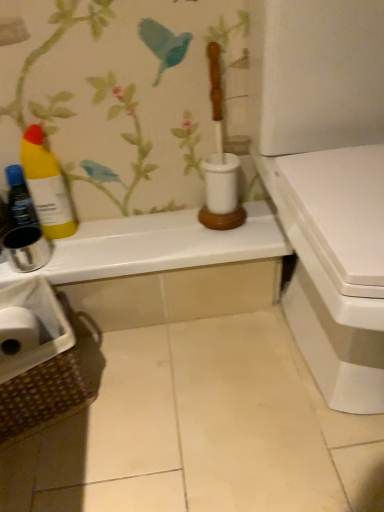
What do you see at coordinates (47, 186) in the screenshot? The image size is (384, 512). I see `yellow matte bottle at left, which is the 2th bottle from left to right` at bounding box center [47, 186].

I want to click on white glossy counter top at upper center, so click(156, 246).

Identify the location of metallic silver bottle at left, which is counted as the 2th bottle, starting from the right. (20, 198).

How much space does metallic silver bottle at left, which is counted as the 2th bottle, starting from the right, occupy horizontally?

It is 2.54 inches.

The image size is (384, 512). Identify the location of white glossy toilet at right. (327, 181).

Image resolution: width=384 pixels, height=512 pixels. Identify the location of counter top that appears above the brown woven laundry basket at lower left (from the image's perspective). (156, 246).

Does point (73, 362) come behind point (245, 204)?

No.

Considering the sizes of objects brown woven laundry basket at lower left and white glossy counter top at upper center in the image provided, who is shorter, brown woven laundry basket at lower left or white glossy counter top at upper center?

white glossy counter top at upper center.

Is brown woven laundry basket at lower left positioned with its back to white glossy counter top at upper center?

No, brown woven laundry basket at lower left is not facing the opposite direction of white glossy counter top at upper center.

Does brown woven laundry basket at lower left turn towards metallic silver bottle at left, which is counted as the 2th bottle, starting from the right?

No, brown woven laundry basket at lower left is not facing towards metallic silver bottle at left, which is counted as the 2th bottle, starting from the right.

Which object is positioned more to the right, brown woven laundry basket at lower left or metallic silver bottle at left, which is counted as the 2th bottle, starting from the right?

Positioned to the right is brown woven laundry basket at lower left.

From a real-world perspective, is brown woven laundry basket at lower left positioned above or below metallic silver bottle at left, the 1th bottle in the left-to-right sequence?

brown woven laundry basket at lower left is situated lower than metallic silver bottle at left, the 1th bottle in the left-to-right sequence, in the real world.

Between brown woven laundry basket at lower left and metallic silver bottle at left, the 1th bottle in the left-to-right sequence, which one is positioned in front?

brown woven laundry basket at lower left is in front.

Is metallic silver bottle at left, which is counted as the 2th bottle, starting from the right, in front of brown woven laundry basket at lower left?

That is False.

From the image's perspective, is metallic silver bottle at left, which is counted as the 2th bottle, starting from the right, below brown woven laundry basket at lower left?

No, from the image's perspective, metallic silver bottle at left, which is counted as the 2th bottle, starting from the right, is not beneath brown woven laundry basket at lower left.

Which object is positioned more to the right, metallic silver bottle at left, the 1th bottle in the left-to-right sequence, or brown woven laundry basket at lower left?

Positioned to the right is brown woven laundry basket at lower left.

Between metallic silver bottle at left, the 1th bottle in the left-to-right sequence, and brown woven laundry basket at lower left, which one has larger size?

Bigger between the two is brown woven laundry basket at lower left.

Is white glossy toilet at right positioned beyond the bounds of metallic silver bottle at left, which is counted as the 2th bottle, starting from the right?

Yes, white glossy toilet at right is outside of metallic silver bottle at left, which is counted as the 2th bottle, starting from the right.

Measure the distance between white glossy toilet at right and metallic silver bottle at left, which is counted as the 2th bottle, starting from the right.

white glossy toilet at right is 70.51 centimeters away from metallic silver bottle at left, which is counted as the 2th bottle, starting from the right.

Does white glossy toilet at right turn towards metallic silver bottle at left, the 1th bottle in the left-to-right sequence?

No.

Is white glossy toilet at right next to metallic silver bottle at left, the 1th bottle in the left-to-right sequence, and touching it?

white glossy toilet at right and metallic silver bottle at left, the 1th bottle in the left-to-right sequence, are clearly separated.

Can you confirm if metallic silver bottle at left, which is counted as the 2th bottle, starting from the right, is shorter than white glossy toilet at right?

Yes, metallic silver bottle at left, which is counted as the 2th bottle, starting from the right, is shorter than white glossy toilet at right.

From a real-world perspective, is metallic silver bottle at left, the 1th bottle in the left-to-right sequence, on top of white glossy toilet at right?

No.

Is point (18, 220) positioned before point (361, 183)?

No, (18, 220) is behind (361, 183).

Looking at this image, considering the sizes of white glossy counter top at upper center and yellow matte bottle at left, which is the 2th bottle from left to right, in the image, is white glossy counter top at upper center wider or thinner than yellow matte bottle at left, which is the 2th bottle from left to right,?

Considering their sizes, white glossy counter top at upper center looks broader than yellow matte bottle at left, which is the 2th bottle from left to right.

From a real-world perspective, is white glossy counter top at upper center physically located above or below yellow matte bottle at left, which is the 2th bottle from left to right?

From a real-world perspective, white glossy counter top at upper center is physically below yellow matte bottle at left, which is the 2th bottle from left to right.

Is white glossy counter top at upper center next to yellow matte bottle at left, the 1th bottle viewed from the right?

No.

In the image, is white glossy counter top at upper center on the left side or the right side of yellow matte bottle at left, which is the 2th bottle from left to right?

white glossy counter top at upper center is to the right of yellow matte bottle at left, which is the 2th bottle from left to right.

How distant is yellow matte bottle at left, the 1th bottle viewed from the right, from white glossy counter top at upper center?

yellow matte bottle at left, the 1th bottle viewed from the right, and white glossy counter top at upper center are 21.96 centimeters apart from each other.

Which of these two, yellow matte bottle at left, the 1th bottle viewed from the right, or white glossy counter top at upper center, stands taller?

yellow matte bottle at left, the 1th bottle viewed from the right, is taller.

Locate an element on the screen. bottle in front of the white glossy counter top at upper center is located at coordinates (47, 186).

From a real-world perspective, which is physically above, yellow matte bottle at left, the 1th bottle viewed from the right, or white glossy counter top at upper center?

From a 3D spatial view, yellow matte bottle at left, the 1th bottle viewed from the right, is above.

You are a GUI agent. You are given a task and a screenshot of the screen. Output one action in this format:
    pyautogui.click(x=<x>, y=<y>)
    Task: Click on the laundry basket in front of the white glossy counter top at upper center
    
    Given the screenshot: What is the action you would take?
    pyautogui.click(x=39, y=359)

There is a brown woven laundry basket at lower left. Find the location of `the 1st bottle above it (from the image's perspective)`. the 1st bottle above it (from the image's perspective) is located at coordinates (20, 198).

Estimate the real-world distances between objects in this image. Which object is further from metallic silver bottle at left, which is counted as the 2th bottle, starting from the right, yellow matte bottle at left, which is the 2th bottle from left to right, or brown woven laundry basket at lower left?

brown woven laundry basket at lower left lies further to metallic silver bottle at left, which is counted as the 2th bottle, starting from the right, than the other object.

From the image, which object appears to be nearer to metallic silver bottle at left, the 1th bottle in the left-to-right sequence, white glossy counter top at upper center or yellow matte bottle at left, the 1th bottle viewed from the right?

Among the two, yellow matte bottle at left, the 1th bottle viewed from the right, is located nearer to metallic silver bottle at left, the 1th bottle in the left-to-right sequence.

From the image, which object appears to be farther from white glossy counter top at upper center, brown woven laundry basket at lower left or metallic silver bottle at left, which is counted as the 2th bottle, starting from the right?

The object further to white glossy counter top at upper center is metallic silver bottle at left, which is counted as the 2th bottle, starting from the right.

Considering their positions, is white glossy toilet at right positioned closer to brown woven laundry basket at lower left than white glossy counter top at upper center?

The object closer to brown woven laundry basket at lower left is white glossy counter top at upper center.

Estimate the real-world distances between objects in this image. Which object is closer to metallic silver bottle at left, which is counted as the 2th bottle, starting from the right, white glossy counter top at upper center or white glossy toilet at right?

Based on the image, white glossy counter top at upper center appears to be nearer to metallic silver bottle at left, which is counted as the 2th bottle, starting from the right.

When comparing their distances from white glossy toilet at right, does brown woven laundry basket at lower left or yellow matte bottle at left, which is the 2th bottle from left to right, seem further?

The object further to white glossy toilet at right is yellow matte bottle at left, which is the 2th bottle from left to right.

Looking at the image, which one is located further to white glossy counter top at upper center, yellow matte bottle at left, the 1th bottle viewed from the right, or white glossy toilet at right?

The object further to white glossy counter top at upper center is white glossy toilet at right.

Which object lies further to the anchor point white glossy toilet at right, white glossy counter top at upper center or brown woven laundry basket at lower left?

brown woven laundry basket at lower left is further to white glossy toilet at right.

The image size is (384, 512). What are the coordinates of `counter top located between yellow matte bottle at left, the 1th bottle viewed from the right, and white glossy toilet at right in the left-right direction` in the screenshot? It's located at point(156,246).

Locate an element on the screen. Image resolution: width=384 pixels, height=512 pixels. laundry basket located between metallic silver bottle at left, which is counted as the 2th bottle, starting from the right, and white glossy toilet at right in the left-right direction is located at coordinates (39, 359).

You are a GUI agent. You are given a task and a screenshot of the screen. Output one action in this format:
    pyautogui.click(x=<x>, y=<y>)
    Task: Click on the bottle that lies between yellow matte bottle at left, the 1th bottle viewed from the right, and brown woven laundry basket at lower left from top to bottom
    
    Given the screenshot: What is the action you would take?
    pyautogui.click(x=20, y=198)

Find the location of a particular element. The width and height of the screenshot is (384, 512). counter top between metallic silver bottle at left, which is counted as the 2th bottle, starting from the right, and brown woven laundry basket at lower left vertically is located at coordinates (156, 246).